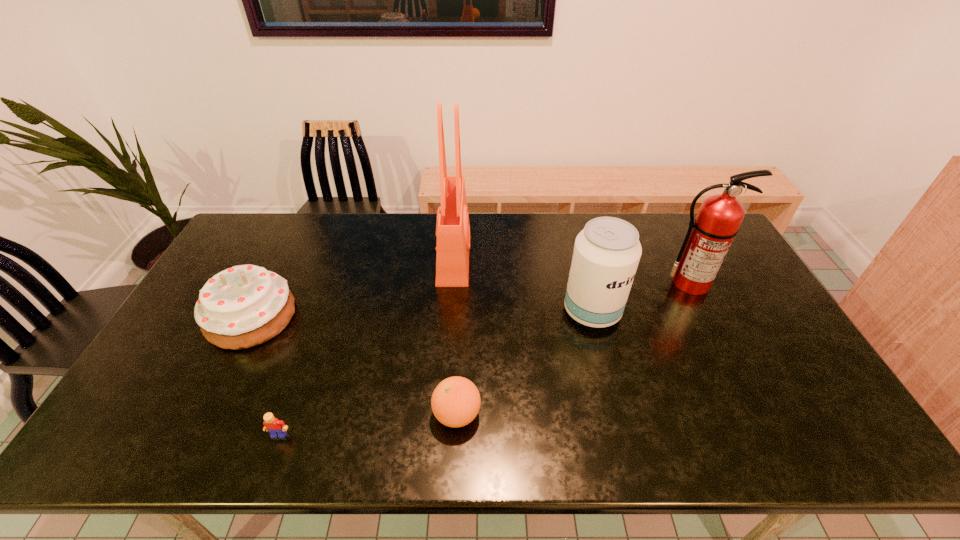
The height and width of the screenshot is (540, 960). I want to click on vacant region between the leftmost object and the tote bag, so click(x=352, y=286).

The width and height of the screenshot is (960, 540). In order to click on vacant region between the second shortest object and the second tallest object in this screenshot , I will do `click(573, 348)`.

Identify the location of vacant area between the tallest object and the Lego. (367, 345).

Where is `vacant area that lies between the leftmost object and the fifth tallest object`? vacant area that lies between the leftmost object and the fifth tallest object is located at coordinates (354, 366).

You are a GUI agent. You are given a task and a screenshot of the screen. Output one action in this format:
    pyautogui.click(x=<x>, y=<y>)
    Task: Click on the object that stands as the second closest to the cake
    The width and height of the screenshot is (960, 540).
    Given the screenshot: What is the action you would take?
    pyautogui.click(x=452, y=226)

In order to click on object identified as the fourth closest to the fifth tallest object in this screenshot , I will do (243, 306).

The width and height of the screenshot is (960, 540). I want to click on vacant space that satisfies the following two spatial constraints: 1. on the logo side of the tote bag; 2. on the face of the Lego, so click(x=442, y=435).